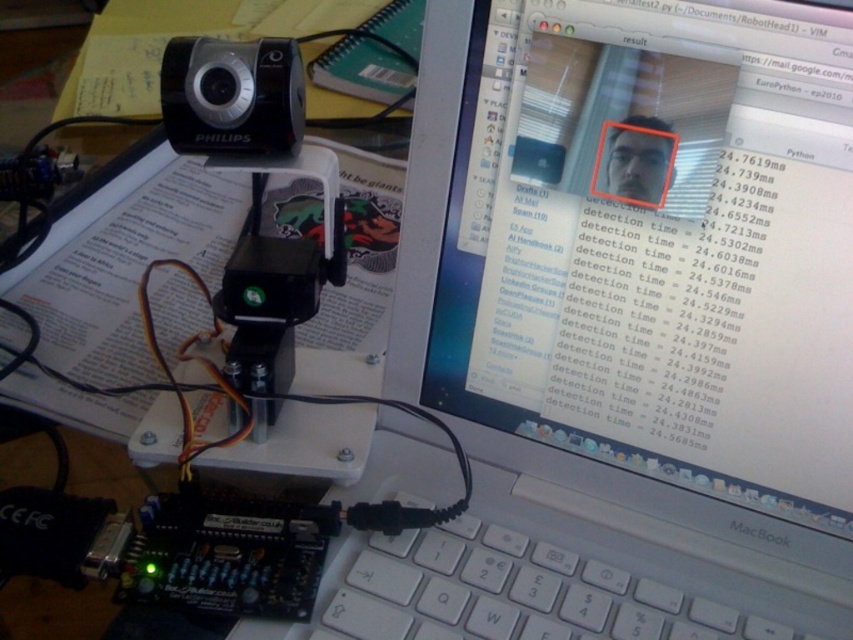
You are setting up a video conferencing system and need to place a new microphone between the matte black monitor at upper center and the black plastic camera at upper left. Given that the microphone requires 10 cm of space to fit, can you determine if there is enough space between them?

The matte black monitor at upper center is larger in size than the black plastic camera at upper left, but the exact distance between them isn t provided. Therefore, it s impossible to determine if there s enough space for the microphone requiring 10 cm of space between them.

You are setting up a computer desk for a coding session. You have a white plastic keyboard at lower center and a black plastic camera at upper left. Which object takes up more space on the desk?

The white plastic keyboard at lower center takes up more space on the desk as it is bigger than the black plastic camera at upper left.